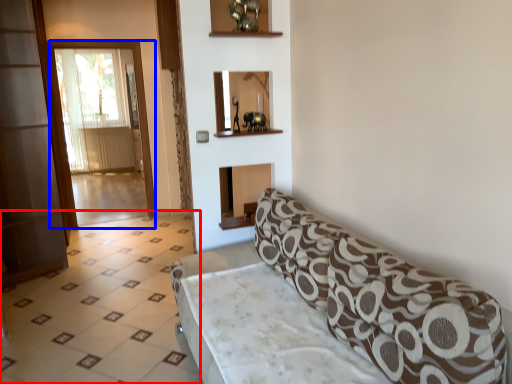
Question: Which object appears farthest to the camera in this image, tile (highlighted by a red box) or screen door (highlighted by a blue box)?

Choices:
 (A) tile
 (B) screen door

Answer: (B)